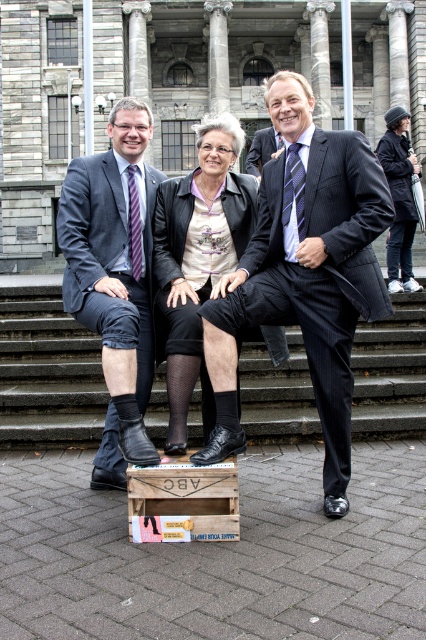
You are standing at the bottom of the stairs and want to reach the matte black suit at center. Which direction should you move relative to the smooth concrete stairs at center?

You should move to the left relative to the smooth concrete stairs at center to reach the matte black suit at center because the stairs are to the right of the suit.

Please describe the clothing of the person located at the coordinate point (115,278) in the image.

The person at coordinate point (115,278) is wearing a matte black suit.